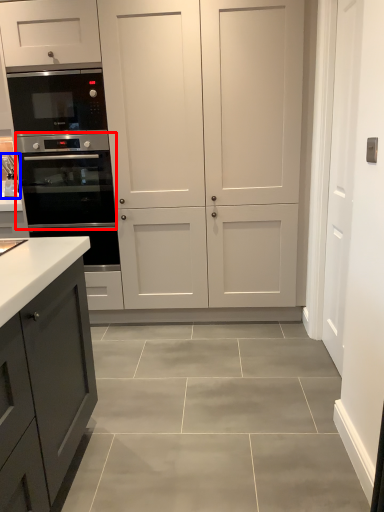
Question: Which point is further to the camera, oven (highlighted by a red box) or sink (highlighted by a blue box)?

Choices:
 (A) oven
 (B) sink

Answer: (B)